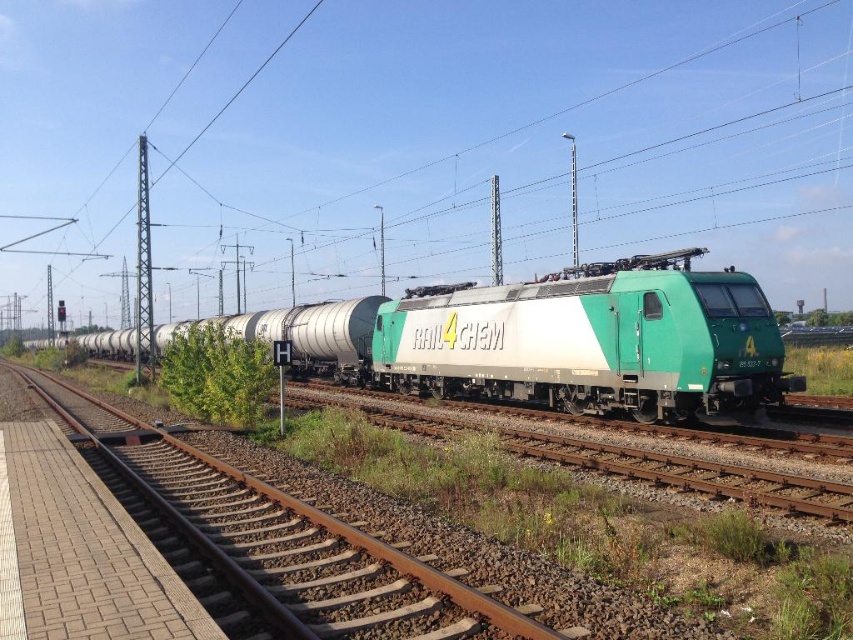
You are a railway inspector checking the alignment of the tracks. You notice the green matte train at center and the green metallic train track at center. Which one is positioned higher relative to the other?

The green matte train at center is above the green metallic train track at center, meaning the train is positioned higher than the track.

You are standing at the point with coordinates (550, 340) in the image. What object are you directly facing?

The point at coordinates (550, 340) corresponds to the green matte train at center, so you are directly facing the green matte train at center.